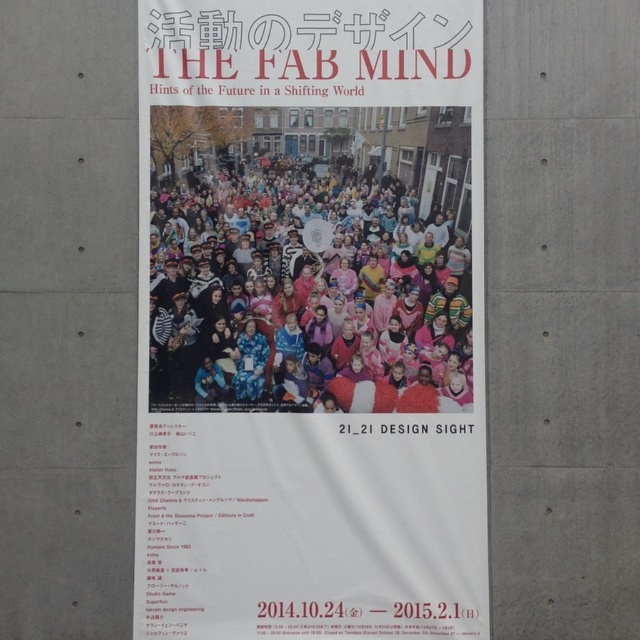
Question: Is white paper poster at upper center wider than multicolored plush at center?

Choices:
 (A) no
 (B) yes

Answer: (B)

Question: Does white paper poster at upper center appear over multicolored plush at center?

Choices:
 (A) no
 (B) yes

Answer: (A)

Question: Among these objects, which one is nearest to the camera?

Choices:
 (A) white paper poster at upper center
 (B) multicolored plush at center

Answer: (A)

Question: From the image, what is the correct spatial relationship of white paper poster at upper center in relation to multicolored plush at center?

Choices:
 (A) left
 (B) right

Answer: (B)

Question: Which of the following is the closest to the observer?

Choices:
 (A) (262, 362)
 (B) (476, 0)

Answer: (A)